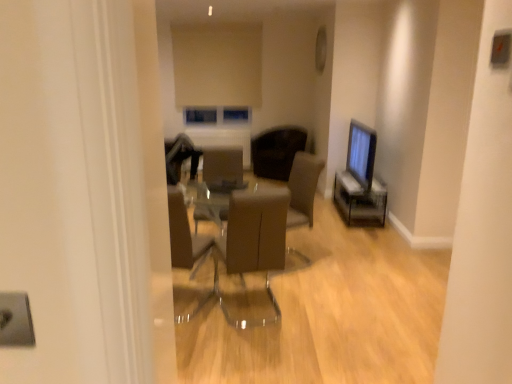
Describe the element at coordinates (253, 243) in the screenshot. I see `brown leather chair at center, the second chair viewed from the back` at that location.

Image resolution: width=512 pixels, height=384 pixels. Identify the location of matte black monitor at right. (361, 154).

From a real-world perspective, is brown leather chair at center, arranged as the second chair when viewed from the front, under matte brown armchair at center?

No.

Is brown leather chair at center, the 2th chair positioned from the bottom, facing towards matte brown armchair at center?

Yes, brown leather chair at center, the 2th chair positioned from the bottom, faces towards matte brown armchair at center.

Is the position of brown leather chair at center, the 1th chair positioned from the back, more distant than that of matte brown armchair at center?

Yes, the depth of brown leather chair at center, the 1th chair positioned from the back, is greater than that of matte brown armchair at center.

Considering the positions of objects brown leather chair at center, arranged as the second chair when viewed from the front, and matte brown armchair at center in the image provided, who is more to the right, brown leather chair at center, arranged as the second chair when viewed from the front, or matte brown armchair at center?

brown leather chair at center, arranged as the second chair when viewed from the front.

Is brown leather chair at center, the 2th chair positioned from the bottom, oriented away from matte black monitor at right?

No, brown leather chair at center, the 2th chair positioned from the bottom, is not facing away from matte black monitor at right.

The height and width of the screenshot is (384, 512). Identify the location of computer monitor above the brown leather chair at center, arranged as the second chair when viewed from the front (from a real-world perspective). (361, 154).

Which object is closer to the camera taking this photo, brown leather chair at center, the 1th chair positioned from the back, or matte black monitor at right?

matte black monitor at right is more forward.

Does brown leather chair at center, which ranks as the 1th chair in top-to-bottom order, have a lesser height compared to matte black monitor at right?

Indeed, brown leather chair at center, which ranks as the 1th chair in top-to-bottom order, has a lesser height compared to matte black monitor at right.

From the image's perspective, is matte brown armchair at center located above or below brown leather chair at center, arranged as the second chair when viewed from the front?

From the image's perspective, matte brown armchair at center appears below brown leather chair at center, arranged as the second chair when viewed from the front.

Does matte brown armchair at center appear on the right side of brown leather chair at center, arranged as the second chair when viewed from the front?

Incorrect, matte brown armchair at center is not on the right side of brown leather chair at center, arranged as the second chair when viewed from the front.

Looking at this image, which of these two, matte brown armchair at center or brown leather chair at center, arranged as the second chair when viewed from the front, is bigger?

brown leather chair at center, arranged as the second chair when viewed from the front.

Identify the location of armchair on the left of matte black monitor at right. (223, 171).

Based on the photo, from a real-world perspective, which is physically above, matte brown armchair at center or matte black monitor at right?

In real-world perspective, matte black monitor at right is above.

From the image's perspective, which is above, matte brown armchair at center or matte black monitor at right?

matte black monitor at right is shown above in the image.

Considering the sizes of objects matte black monitor at right and matte brown armchair at center in the image provided, who is taller, matte black monitor at right or matte brown armchair at center?

With more height is matte brown armchair at center.

Consider the image. How far apart are matte black monitor at right and matte brown armchair at center?

They are 6.22 feet apart.

Is matte black monitor at right outside of matte brown armchair at center?

Yes.

From the picture: Between matte black monitor at right and matte brown armchair at center, which one has smaller size?

Smaller between the two is matte black monitor at right.

Is brown leather chair at center, acting as the 1th chair starting from the front, situated inside matte brown armchair at center or outside?

brown leather chair at center, acting as the 1th chair starting from the front, is outside matte brown armchair at center.

Which point is more distant from viewer, (258,258) or (215,179)?

The point (215,179) is more distant.

Identify the location of armchair above the brown leather chair at center, acting as the 1th chair starting from the front (from the image's perspective). (223, 171).

Considering the positions of objects brown leather chair at center, the 1th chair positioned from the bottom, and matte brown armchair at center in the image provided, who is behind, brown leather chair at center, the 1th chair positioned from the bottom, or matte brown armchair at center?

matte brown armchair at center is further away from the camera.

How distant is matte black monitor at right from brown leather chair at center, arranged as the second chair when viewed from the front?

matte black monitor at right is 32.72 inches from brown leather chair at center, arranged as the second chair when viewed from the front.

From a real-world perspective, which object rests below the other?

From a 3D spatial view, brown leather chair at center, the 2th chair positioned from the bottom, is below.

Is matte black monitor at right at the right side of brown leather chair at center, which ranks as the 1th chair in top-to-bottom order?

Yes, matte black monitor at right is to the right of brown leather chair at center, which ranks as the 1th chair in top-to-bottom order.

From the matte black monitor at right, count the 1st chair to the left and point to it. Please provide its 2D coordinates.

[(276, 151)]

Where is `armchair located underneath the brown leather chair at center, which ranks as the 1th chair in top-to-bottom order (from a real-world perspective)`? The image size is (512, 384). armchair located underneath the brown leather chair at center, which ranks as the 1th chair in top-to-bottom order (from a real-world perspective) is located at coordinates (223, 171).

Locate an element on the screen. computer monitor below the brown leather chair at center, which ranks as the 1th chair in top-to-bottom order (from the image's perspective) is located at coordinates (361, 154).

Which object lies further to the anchor point brown leather chair at center, arranged as the second chair when viewed from the front, brown leather chair at center, acting as the 1th chair starting from the front, or matte brown armchair at center?

Among the two, brown leather chair at center, acting as the 1th chair starting from the front, is located further to brown leather chair at center, arranged as the second chair when viewed from the front.

Considering their positions, is brown leather chair at center, which ranks as the 1th chair in top-to-bottom order, positioned further to matte brown armchair at center than matte black monitor at right?

The object further to matte brown armchair at center is matte black monitor at right.

Which object lies nearer to the anchor point brown leather chair at center, the second chair viewed from the back, matte black monitor at right or brown leather chair at center, the 1th chair positioned from the back?

brown leather chair at center, the 1th chair positioned from the back.

Estimate the real-world distances between objects in this image. Which object is closer to brown leather chair at center, the 1th chair positioned from the back, matte black monitor at right or brown leather chair at center, which is counted as the second chair, starting from the top?

Among the two, matte black monitor at right is located nearer to brown leather chair at center, the 1th chair positioned from the back.

In the scene shown: Based on their spatial positions, is brown leather chair at center, arranged as the second chair when viewed from the front, or matte brown armchair at center further from brown leather chair at center, acting as the 1th chair starting from the front?

brown leather chair at center, arranged as the second chair when viewed from the front, is further to brown leather chair at center, acting as the 1th chair starting from the front.

Estimate the real-world distances between objects in this image. Which object is further from brown leather chair at center, the 1th chair positioned from the bottom, matte brown armchair at center or brown leather chair at center, the 1th chair positioned from the back?

Among the two, brown leather chair at center, the 1th chair positioned from the back, is located further to brown leather chair at center, the 1th chair positioned from the bottom.

Based on their spatial positions, is brown leather chair at center, which ranks as the 1th chair in top-to-bottom order, or brown leather chair at center, the 1th chair positioned from the bottom, closer to matte black monitor at right?

Among the two, brown leather chair at center, which ranks as the 1th chair in top-to-bottom order, is located nearer to matte black monitor at right.

Looking at the image, which one is located further to matte black monitor at right, matte brown armchair at center or brown leather chair at center, the 2th chair positioned from the bottom?

matte brown armchair at center lies further to matte black monitor at right than the other object.

You are a GUI agent. You are given a task and a screenshot of the screen. Output one action in this format:
    pyautogui.click(x=<x>, y=<y>)
    Task: Click on the computer monitor between brown leather chair at center, acting as the 1th chair starting from the front, and brown leather chair at center, arranged as the second chair when viewed from the front, in the front-back direction
    
    Given the screenshot: What is the action you would take?
    pyautogui.click(x=361, y=154)

Image resolution: width=512 pixels, height=384 pixels. I want to click on armchair between brown leather chair at center, the 1th chair positioned from the bottom, and brown leather chair at center, the 2th chair positioned from the bottom, along the z-axis, so click(x=223, y=171).

The image size is (512, 384). I want to click on armchair located between brown leather chair at center, the 1th chair positioned from the bottom, and matte black monitor at right in the depth direction, so click(x=223, y=171).

At what (x,y) coordinates should I click in order to perform the action: click on computer monitor between matte brown armchair at center and brown leather chair at center, the 2th chair positioned from the bottom, from front to back. Please return your answer as a coordinate pair (x, y). Image resolution: width=512 pixels, height=384 pixels. Looking at the image, I should click on (361, 154).